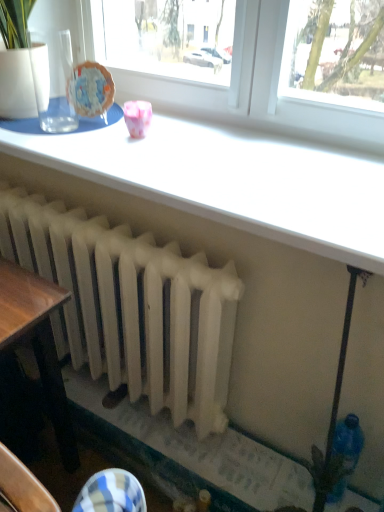
Question: From the image's perspective, is white matte radiator at center above white glossy table at upper center?

Choices:
 (A) yes
 (B) no

Answer: (B)

Question: Would you consider white matte radiator at center to be distant from white glossy table at upper center?

Choices:
 (A) no
 (B) yes

Answer: (A)

Question: Is white matte radiator at center next to white glossy table at upper center?

Choices:
 (A) no
 (B) yes

Answer: (A)

Question: Is white matte radiator at center thinner than white glossy table at upper center?

Choices:
 (A) no
 (B) yes

Answer: (B)

Question: Considering the relative sizes of white matte radiator at center and white glossy table at upper center in the image provided, is white matte radiator at center wider than white glossy table at upper center?

Choices:
 (A) yes
 (B) no

Answer: (B)

Question: From a real-world perspective, is white matte radiator at center under white glossy table at upper center?

Choices:
 (A) no
 (B) yes

Answer: (B)

Question: Considering the relative sizes of white matte radiator at center and pink glossy cup at upper center in the image provided, is white matte radiator at center thinner than pink glossy cup at upper center?

Choices:
 (A) yes
 (B) no

Answer: (B)

Question: From a real-world perspective, does white matte radiator at center stand above pink glossy cup at upper center?

Choices:
 (A) no
 (B) yes

Answer: (A)

Question: Is white matte radiator at center positioned with its back to pink glossy cup at upper center?

Choices:
 (A) no
 (B) yes

Answer: (A)

Question: Is white matte radiator at center not close to pink glossy cup at upper center?

Choices:
 (A) no
 (B) yes

Answer: (A)

Question: Is white matte radiator at center wider than pink glossy cup at upper center?

Choices:
 (A) no
 (B) yes

Answer: (B)

Question: From the image's perspective, is white matte radiator at center over pink glossy cup at upper center?

Choices:
 (A) yes
 (B) no

Answer: (B)

Question: Is pink glossy cup at upper center smaller than white matte radiator at center?

Choices:
 (A) no
 (B) yes

Answer: (B)